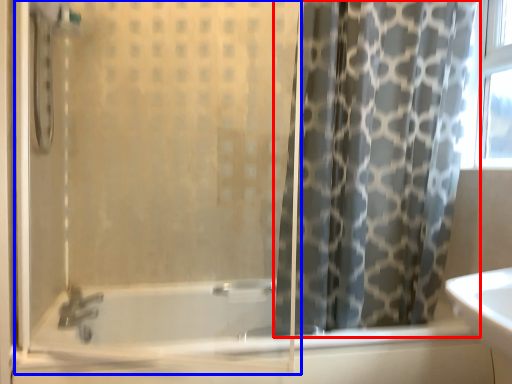
Question: Which object appears closest to the camera in this image, curtain (highlighted by a red box) or screen door (highlighted by a blue box)?

Choices:
 (A) curtain
 (B) screen door

Answer: (B)